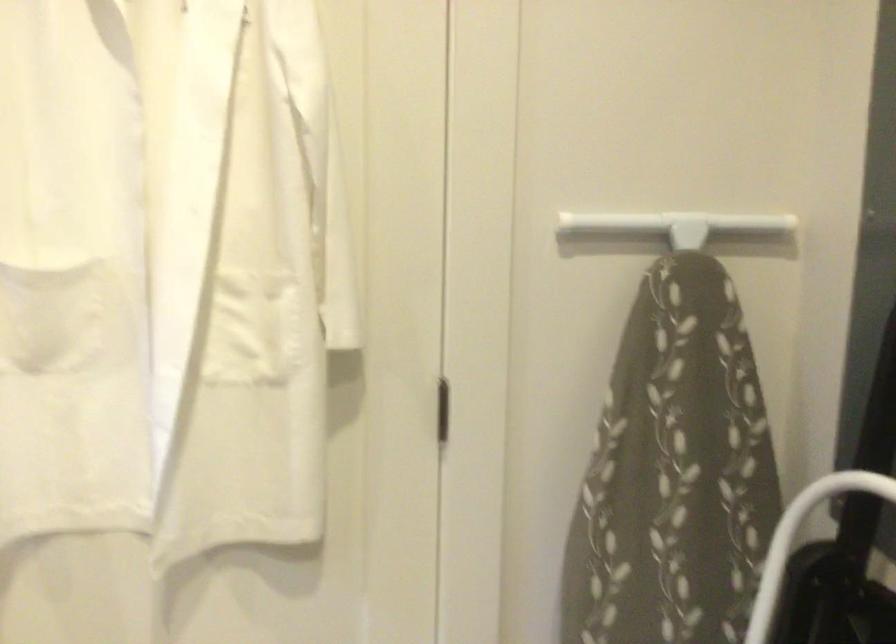
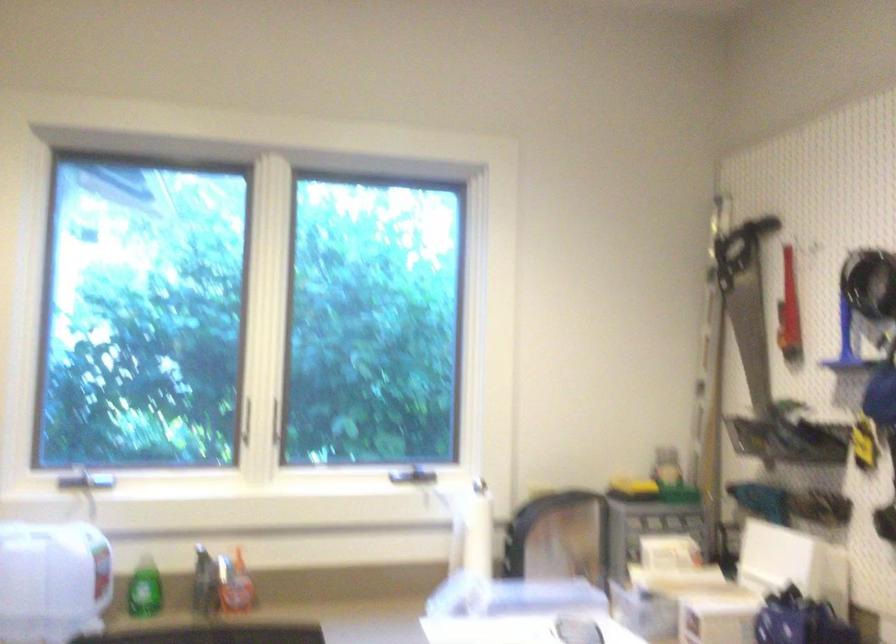
Question: The camera is either moving clockwise (left) or counter-clockwise (right) around the object. The first image is from the beginning of the video and the second image is from the end. Is the camera moving left or right when shooting the video?

Choices:
 (A) Left
 (B) Right

Answer: (B)